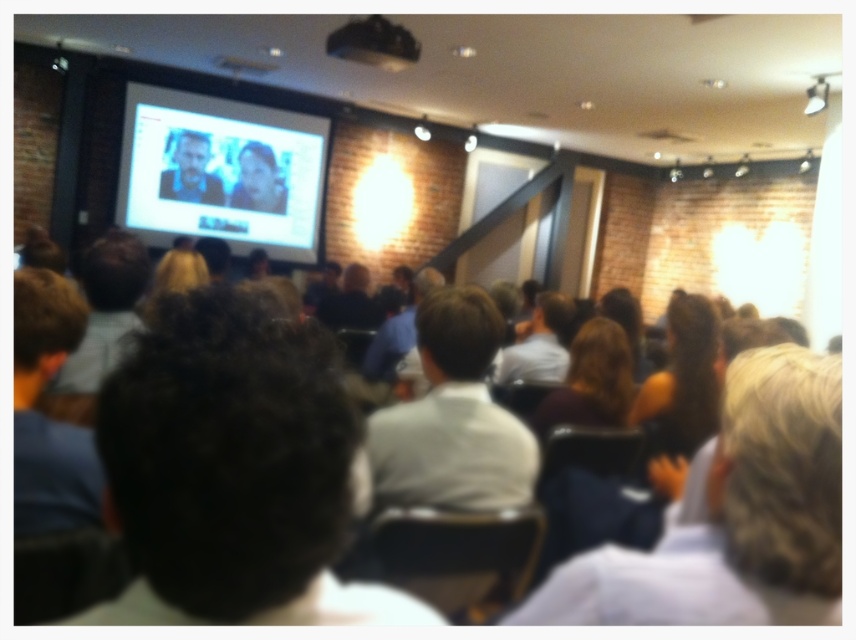
Question: Does dark curly hair at center have a lesser width compared to dark blue shirt at left?

Choices:
 (A) no
 (B) yes

Answer: (A)

Question: Which of the following is the closest to the observer?

Choices:
 (A) dark blue shirt at left
 (B) black matte projector at upper center

Answer: (A)

Question: Which is nearer to the dark brown hair at left?

Choices:
 (A) blonde hair at right
 (B) dark curly hair at center

Answer: (B)

Question: Is dark curly hair at center to the right of blonde hair at right from the viewer's perspective?

Choices:
 (A) yes
 (B) no

Answer: (B)

Question: Does white glossy projection screen at upper left appear on the right side of black matte projector at upper center?

Choices:
 (A) no
 (B) yes

Answer: (A)

Question: Which object is farther from the camera taking this photo?

Choices:
 (A) dark curly hair at center
 (B) dark blue shirt at left
 (C) black matte projector at upper center

Answer: (C)